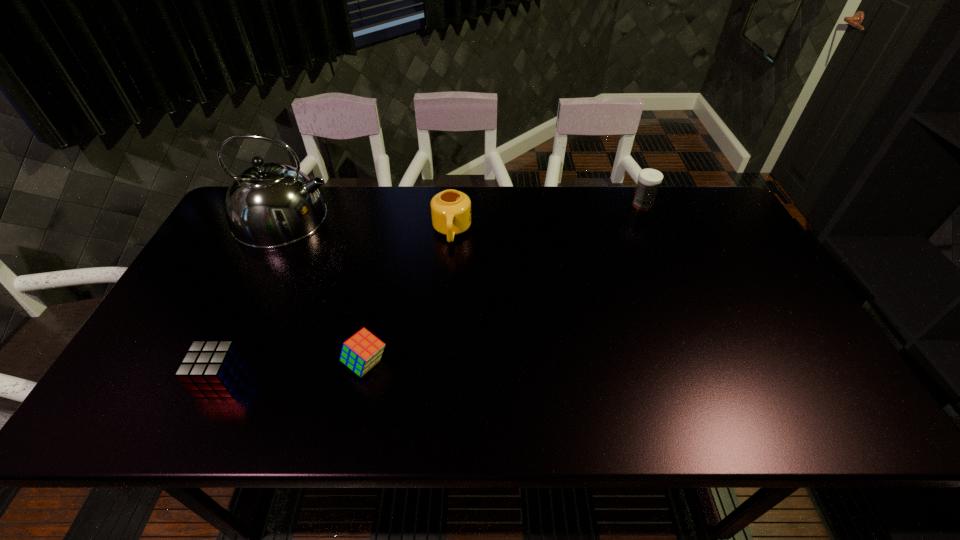
Where is `free location that satisfies the following two spatial constraints: 1. from the spout of the tallest object; 2. on the right side of the left cube`? Image resolution: width=960 pixels, height=540 pixels. free location that satisfies the following two spatial constraints: 1. from the spout of the tallest object; 2. on the right side of the left cube is located at coordinates (205, 380).

This screenshot has height=540, width=960. What are the coordinates of `free space that satisfies the following two spatial constraints: 1. from the spout of the right cube; 2. on the left side of the tallest object` in the screenshot? It's located at (213, 363).

Identify the location of free location that satisfies the following two spatial constraints: 1. from the spout of the tallest object; 2. on the right side of the third object from left to right. (213, 363).

I want to click on vacant point that satisfies the following two spatial constraints: 1. from the spout of the left cube; 2. on the right side of the kettle, so [x=205, y=380].

This screenshot has width=960, height=540. In order to click on vacant position in the image that satisfies the following two spatial constraints: 1. from the spout of the tallest object; 2. on the right side of the right cube in this screenshot , I will do `click(213, 363)`.